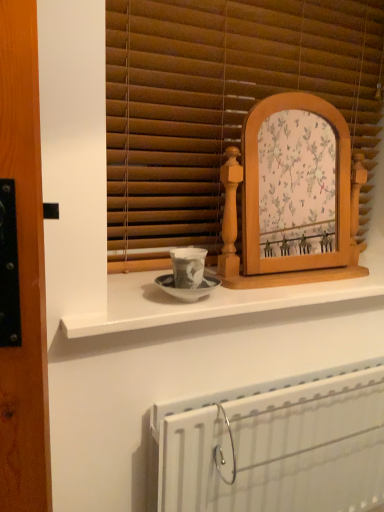
Question: From a real-world perspective, is wooden picture frame at center beneath white metallic radiator at lower center?

Choices:
 (A) no
 (B) yes

Answer: (A)

Question: Is wooden picture frame at center next to white metallic radiator at lower center and touching it?

Choices:
 (A) no
 (B) yes

Answer: (A)

Question: Is wooden picture frame at center wider than white metallic radiator at lower center?

Choices:
 (A) no
 (B) yes

Answer: (A)

Question: From the image's perspective, does wooden picture frame at center appear higher than white metallic radiator at lower center?

Choices:
 (A) yes
 (B) no

Answer: (A)

Question: Can we say wooden picture frame at center lies outside white metallic radiator at lower center?

Choices:
 (A) yes
 (B) no

Answer: (A)

Question: Is wooden picture frame at center facing towards white metallic radiator at lower center?

Choices:
 (A) yes
 (B) no

Answer: (B)

Question: Considering the relative sizes of wooden blinds at center and white metallic radiator at lower center in the image provided, is wooden blinds at center bigger than white metallic radiator at lower center?

Choices:
 (A) yes
 (B) no

Answer: (A)

Question: Does wooden blinds at center come behind white metallic radiator at lower center?

Choices:
 (A) no
 (B) yes

Answer: (B)

Question: Is wooden blinds at center shorter than white metallic radiator at lower center?

Choices:
 (A) no
 (B) yes

Answer: (A)

Question: Would you say wooden blinds at center contains white metallic radiator at lower center?

Choices:
 (A) yes
 (B) no

Answer: (B)

Question: Is wooden blinds at center beside white metallic radiator at lower center?

Choices:
 (A) no
 (B) yes

Answer: (A)

Question: Can you confirm if wooden blinds at center is taller than white metallic radiator at lower center?

Choices:
 (A) yes
 (B) no

Answer: (A)

Question: Is white glossy counter at center at the right side of wooden blinds at center?

Choices:
 (A) no
 (B) yes

Answer: (A)